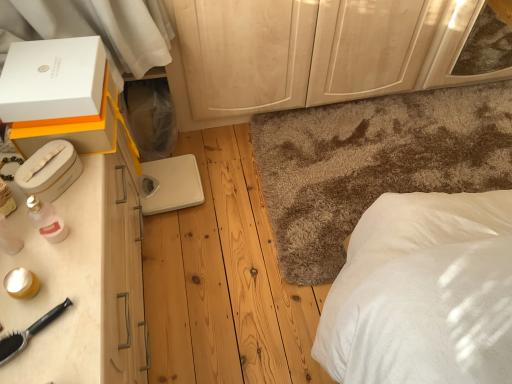
I want to click on free space that is in between white plastic box at left, which appears as the 3th box when viewed from the top, and black plastic brush at lower left, so click(44, 241).